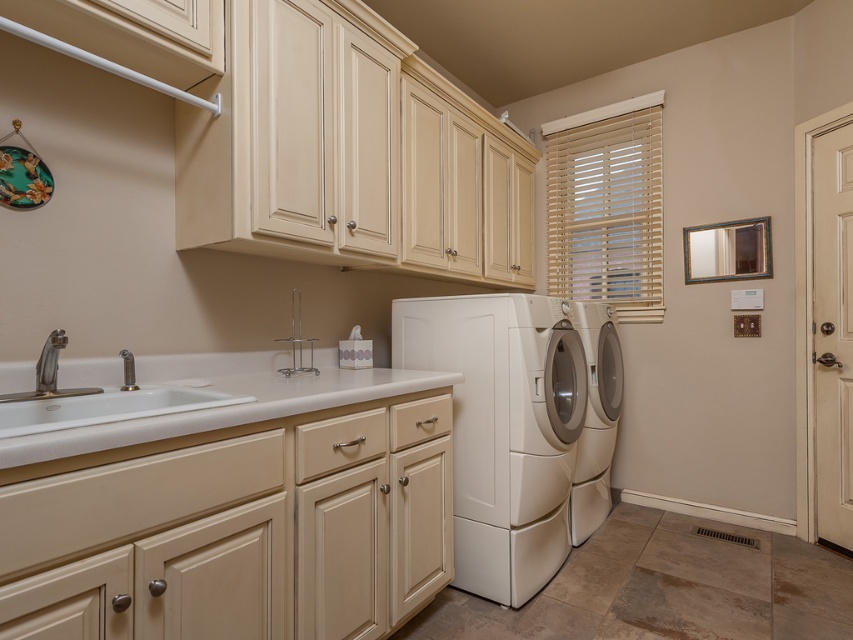
Is white glossy washing machine at center bigger than silver metallic faucet at sink left?

Yes.

Does point (469, 488) lie behind point (119, 355)?

Yes, point (469, 488) is farther from viewer.

Identify the location of white glossy washing machine at center. (502, 429).

The width and height of the screenshot is (853, 640). I want to click on white glossy washing machine at center, so click(x=502, y=429).

Does white laminate counter at lower left appear on the left side of silver metallic faucet at sink left?

No, white laminate counter at lower left is not to the left of silver metallic faucet at sink left.

Which is in front, point (144, 420) or point (126, 353)?

Positioned in front is point (144, 420).

Where is `white laminate counter at lower left`? white laminate counter at lower left is located at coordinates (227, 408).

Based on the photo, is white glossy washing machine at center closer to the viewer compared to white glossy washing machine at right?

→ Yes, white glossy washing machine at center is closer to the viewer.

Is point (578, 376) farther from viewer compared to point (590, 500)?

No, (578, 376) is in front of (590, 500).

Find the location of a particular element. The image size is (853, 640). white glossy washing machine at center is located at coordinates (502, 429).